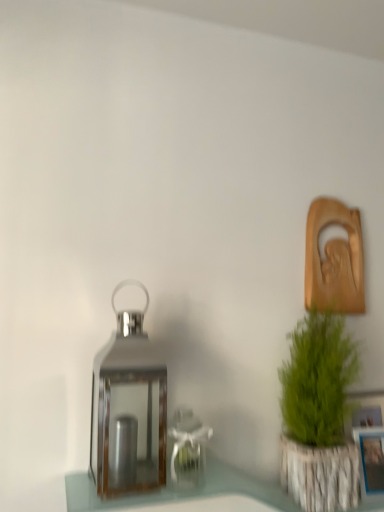
Find the location of a particular element. shiny metallic lantern at center is located at coordinates (128, 409).

Find the location of a particular element. This screenshot has width=384, height=512. green textured plant at right is located at coordinates (319, 415).

Is blue plastic picture frame at lower right oriented away from shiny metallic lantern at center?

No, blue plastic picture frame at lower right is not facing the opposite direction of shiny metallic lantern at center.

Are blue plastic picture frame at lower right and shiny metallic lantern at center far apart?

That's not correct — blue plastic picture frame at lower right is a little close to shiny metallic lantern at center.

Is blue plastic picture frame at lower right closer to camera compared to shiny metallic lantern at center?

No, the depth of blue plastic picture frame at lower right is greater than that of shiny metallic lantern at center.

Is green textured plant at right facing away from blue plastic picture frame at lower right?

That's not correct — green textured plant at right is not looking away from blue plastic picture frame at lower right.

Does green textured plant at right appear on the left side of blue plastic picture frame at lower right?

Correct, you'll find green textured plant at right to the left of blue plastic picture frame at lower right.

Considering the sizes of objects green textured plant at right and blue plastic picture frame at lower right in the image provided, who is smaller, green textured plant at right or blue plastic picture frame at lower right?

blue plastic picture frame at lower right.

From a real-world perspective, is shiny metallic lantern at center on top of blue plastic picture frame at lower right?

Correct, in the physical world, shiny metallic lantern at center is higher than blue plastic picture frame at lower right.

Considering the sizes of shiny metallic lantern at center and blue plastic picture frame at lower right in the image, is shiny metallic lantern at center taller or shorter than blue plastic picture frame at lower right?

shiny metallic lantern at center is taller than blue plastic picture frame at lower right.

Considering their positions, is shiny metallic lantern at center located in front of or behind blue plastic picture frame at lower right?

In the image, shiny metallic lantern at center appears in front of blue plastic picture frame at lower right.

Considering the sizes of objects blue plastic picture frame at lower right and green textured plant at right in the image provided, who is wider, blue plastic picture frame at lower right or green textured plant at right?

green textured plant at right.

Which object is further away from the camera, blue plastic picture frame at lower right or green textured plant at right?

blue plastic picture frame at lower right is behind.

From a real-world perspective, is blue plastic picture frame at lower right located beneath green textured plant at right?

Yes.

Is green textured plant at right completely or partially inside blue plastic picture frame at lower right?

Actually, green textured plant at right is outside blue plastic picture frame at lower right.

Is green textured plant at right directly adjacent to shiny metallic lantern at center?

No, green textured plant at right is not touching shiny metallic lantern at center.

Does green textured plant at right contain shiny metallic lantern at center?

Actually, shiny metallic lantern at center is outside green textured plant at right.

Which object is more forward, green textured plant at right or shiny metallic lantern at center?

Positioned in front is shiny metallic lantern at center.

Does green textured plant at right have a larger size compared to shiny metallic lantern at center?

Yes.

What's the angular difference between shiny metallic lantern at center and green textured plant at right's facing directions?

There is a 1.3-degree angle between the facing directions of shiny metallic lantern at center and green textured plant at right.

In the image, is shiny metallic lantern at center positioned in front of or behind green textured plant at right?

Clearly, shiny metallic lantern at center is in front of green textured plant at right.

Which of these two, shiny metallic lantern at center or green textured plant at right, stands taller?

green textured plant at right is taller.

Find the location of a particular element. This screenshot has height=512, width=384. lantern in front of the green textured plant at right is located at coordinates (128, 409).

The width and height of the screenshot is (384, 512). I want to click on lantern above the blue plastic picture frame at lower right (from a real-world perspective), so click(128, 409).

The height and width of the screenshot is (512, 384). I want to click on houseplant on the left of blue plastic picture frame at lower right, so click(319, 415).

When comparing their distances from green textured plant at right, does blue plastic picture frame at lower right or shiny metallic lantern at center seem closer?

blue plastic picture frame at lower right is positioned closer to the anchor green textured plant at right.

Looking at the image, which one is located further to shiny metallic lantern at center, blue plastic picture frame at lower right or green textured plant at right?

blue plastic picture frame at lower right.

Estimate the real-world distances between objects in this image. Which object is closer to blue plastic picture frame at lower right, shiny metallic lantern at center or green textured plant at right?

Based on the image, green textured plant at right appears to be nearer to blue plastic picture frame at lower right.

Based on their spatial positions, is green textured plant at right or shiny metallic lantern at center closer to blue plastic picture frame at lower right?

Based on the image, green textured plant at right appears to be nearer to blue plastic picture frame at lower right.

Looking at the image, which one is located closer to green textured plant at right, shiny metallic lantern at center or blue plastic picture frame at lower right?

blue plastic picture frame at lower right is positioned closer to the anchor green textured plant at right.

Considering their positions, is green textured plant at right positioned closer to shiny metallic lantern at center than blue plastic picture frame at lower right?

green textured plant at right lies closer to shiny metallic lantern at center than the other object.

At what (x,y) coordinates should I click in order to perform the action: click on houseplant between shiny metallic lantern at center and blue plastic picture frame at lower right in the horizontal direction. Please return your answer as a coordinate pair (x, y). Image resolution: width=384 pixels, height=512 pixels. Looking at the image, I should click on (319, 415).